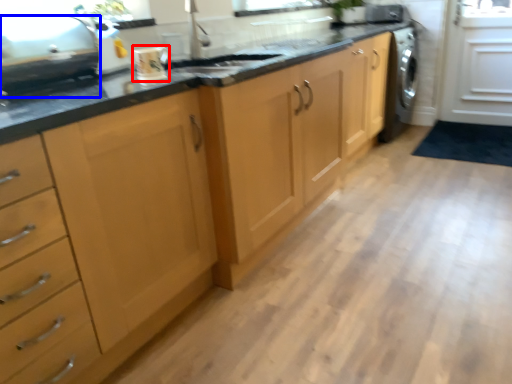
Question: Which of the following is the farthest to the observer, kitchen appliance (highlighted by a red box) or appliance (highlighted by a blue box)?

Choices:
 (A) kitchen appliance
 (B) appliance

Answer: (A)